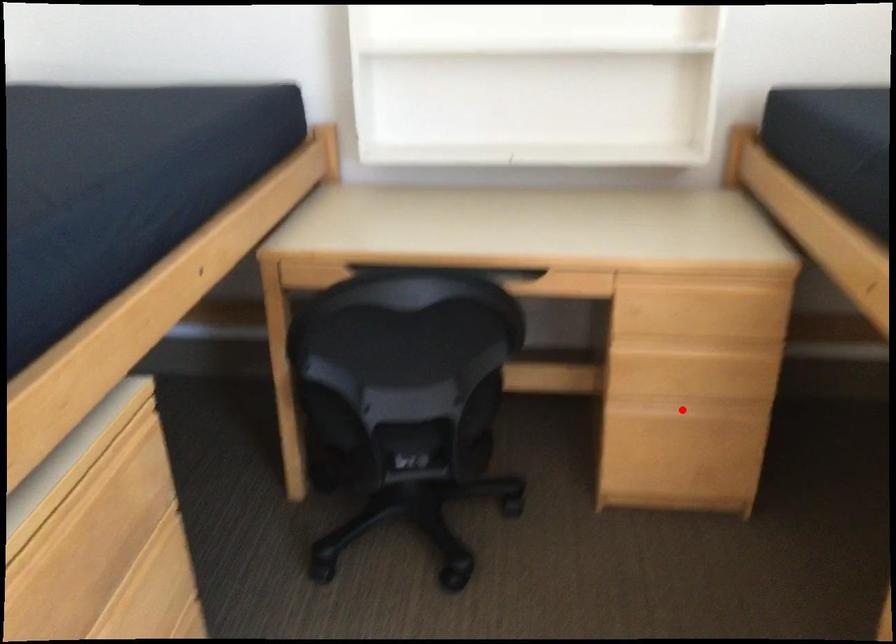
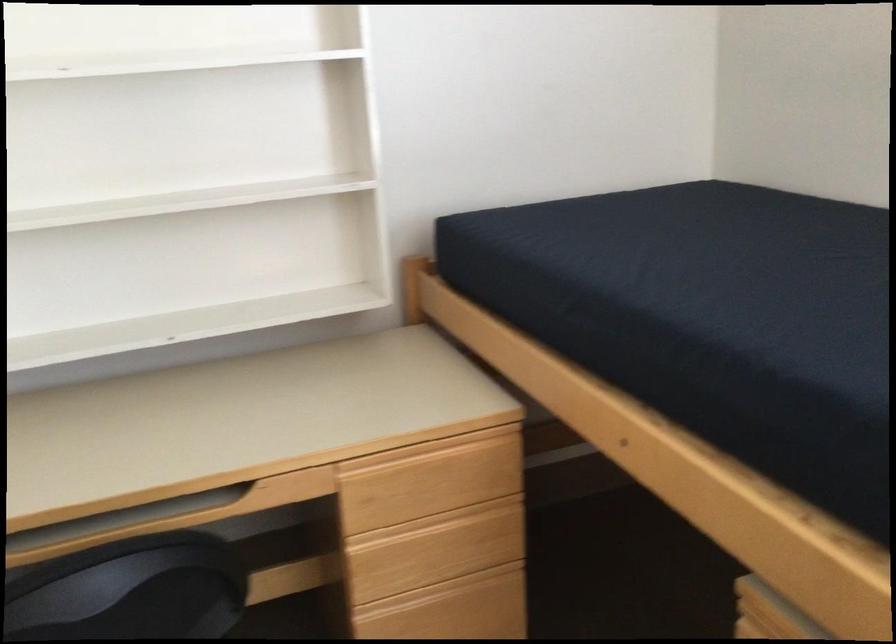
Question: I am providing you with two images of the same scene from different viewpoints. In image1, a red point is highlighted. Considering the same 3D point in image2, which of the following is correct?

Choices:
 (A) It is closer
 (B) It is farther

Answer: (A)